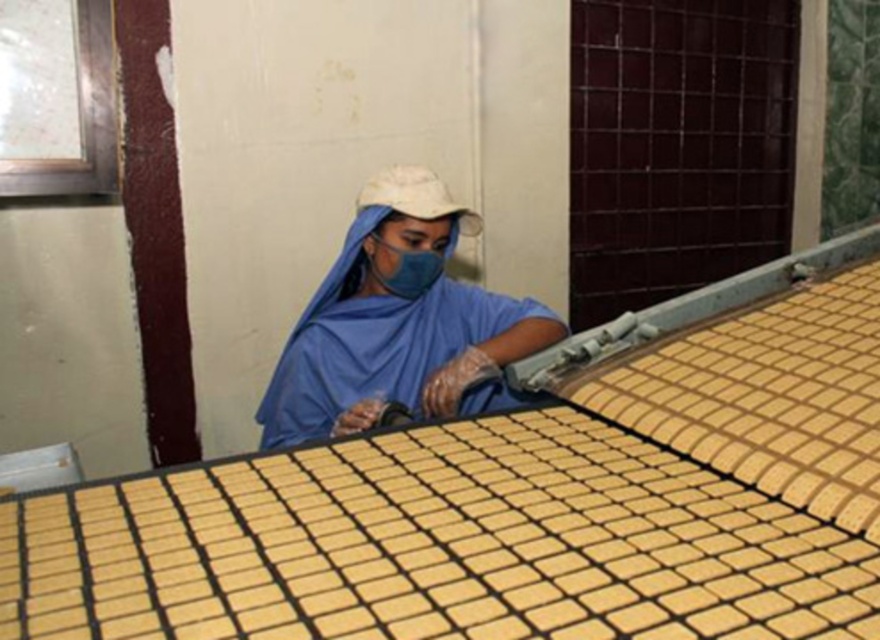
Question: Does blue fabric robe at center have a greater width compared to blue fabric mask at center?

Choices:
 (A) no
 (B) yes

Answer: (B)

Question: Which point is closer to the camera?

Choices:
 (A) (277, 422)
 (B) (419, 248)

Answer: (B)

Question: Which point is farther to the camera?

Choices:
 (A) (356, 316)
 (B) (440, 224)

Answer: (A)

Question: Does blue fabric robe at center appear on the right side of blue fabric mask at center?

Choices:
 (A) yes
 (B) no

Answer: (B)

Question: Is blue fabric robe at center above blue fabric mask at center?

Choices:
 (A) yes
 (B) no

Answer: (B)